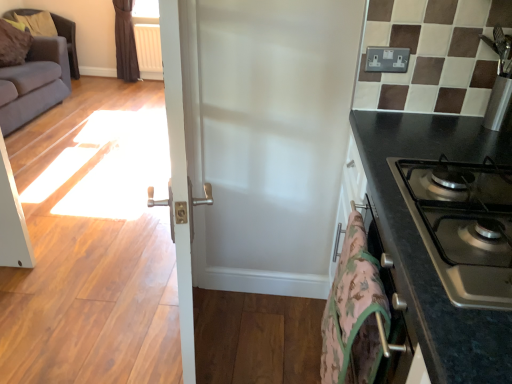
Question: From a real-world perspective, does camouflage fabric blanket at lower right sit lower than white plastic radiator at upper left?

Choices:
 (A) no
 (B) yes

Answer: (A)

Question: Could you tell me if camouflage fabric blanket at lower right is facing white plastic radiator at upper left?

Choices:
 (A) yes
 (B) no

Answer: (B)

Question: Can you confirm if camouflage fabric blanket at lower right is wider than white plastic radiator at upper left?

Choices:
 (A) yes
 (B) no

Answer: (B)

Question: Would you say white plastic radiator at upper left is part of camouflage fabric blanket at lower right's contents?

Choices:
 (A) no
 (B) yes

Answer: (A)

Question: Does camouflage fabric blanket at lower right lie in front of white plastic radiator at upper left?

Choices:
 (A) no
 (B) yes

Answer: (B)

Question: From their relative heights in the image, would you say white glossy door at center is taller or shorter than white plastic radiator at upper left?

Choices:
 (A) tall
 (B) short

Answer: (A)

Question: Considering their positions, is white glossy door at center located in front of or behind white plastic radiator at upper left?

Choices:
 (A) front
 (B) behind

Answer: (A)

Question: Which is correct: white glossy door at center is inside white plastic radiator at upper left, or outside of it?

Choices:
 (A) inside
 (B) outside

Answer: (B)

Question: From the image's perspective, is white glossy door at center above or below white plastic radiator at upper left?

Choices:
 (A) below
 (B) above

Answer: (A)

Question: Is point (186, 347) positioned closer to the camera than point (411, 246)?

Choices:
 (A) farther
 (B) closer

Answer: (A)

Question: Visually, is white glossy door at center positioned to the left or to the right of black granite countertop at right?

Choices:
 (A) right
 (B) left

Answer: (B)

Question: Considering the positions of white glossy door at center and black granite countertop at right in the image, is white glossy door at center bigger or smaller than black granite countertop at right?

Choices:
 (A) small
 (B) big

Answer: (A)

Question: From the image's perspective, is white glossy door at center above or below black granite countertop at right?

Choices:
 (A) above
 (B) below

Answer: (A)

Question: Is stainless steel gas stove at right bigger or smaller than black granite countertop at right?

Choices:
 (A) small
 (B) big

Answer: (A)

Question: Is stainless steel gas stove at right spatially inside black granite countertop at right, or outside of it?

Choices:
 (A) outside
 (B) inside

Answer: (B)